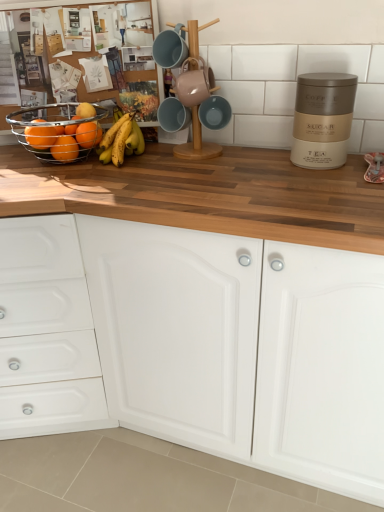
Question: Is yellow matte bananas at center shorter than orange matte at left, positioned as the fourth orange in front-to-back order?

Choices:
 (A) no
 (B) yes

Answer: (A)

Question: Considering the relative sizes of yellow matte bananas at center and orange matte at left, positioned as the fourth orange in front-to-back order, in the image provided, is yellow matte bananas at center taller than orange matte at left, positioned as the fourth orange in front-to-back order,?

Choices:
 (A) no
 (B) yes

Answer: (B)

Question: Is yellow matte bananas at center not inside orange matte at left, the first orange in the back-to-front sequence?

Choices:
 (A) yes
 (B) no

Answer: (A)

Question: From the image's perspective, is yellow matte bananas at center over orange matte at left, positioned as the fourth orange in front-to-back order?

Choices:
 (A) yes
 (B) no

Answer: (A)

Question: Is yellow matte bananas at center to the left of orange matte at left, positioned as the fourth orange in front-to-back order, from the viewer's perspective?

Choices:
 (A) no
 (B) yes

Answer: (A)

Question: Considering the relative sizes of yellow matte bananas at center and orange matte at left, the first orange in the back-to-front sequence, in the image provided, is yellow matte bananas at center smaller than orange matte at left, the first orange in the back-to-front sequence,?

Choices:
 (A) yes
 (B) no

Answer: (B)

Question: Could you tell me if orange matte at left, positioned as the fourth orange in front-to-back order, is facing yellow matte bananas at center?

Choices:
 (A) yes
 (B) no

Answer: (B)

Question: Can you confirm if orange matte at left, positioned as the fourth orange in front-to-back order, is wider than yellow matte bananas at center?

Choices:
 (A) no
 (B) yes

Answer: (A)

Question: Is orange matte at left, positioned as the fourth orange in front-to-back order, turned away from yellow matte bananas at center?

Choices:
 (A) yes
 (B) no

Answer: (B)

Question: Can you confirm if orange matte at left, positioned as the fourth orange in front-to-back order, is smaller than yellow matte bananas at center?

Choices:
 (A) no
 (B) yes

Answer: (B)

Question: Is orange matte at left, the first orange in the back-to-front sequence, to the left of yellow matte bananas at center from the viewer's perspective?

Choices:
 (A) no
 (B) yes

Answer: (B)

Question: From a real-world perspective, is orange matte at left, the first orange in the back-to-front sequence, over yellow matte bananas at center?

Choices:
 (A) yes
 (B) no

Answer: (A)

Question: From a real-world perspective, does yellow matte bananas at center sit lower than matte orange at left, marked as the third orange in a back-to-front arrangement?

Choices:
 (A) yes
 (B) no

Answer: (A)